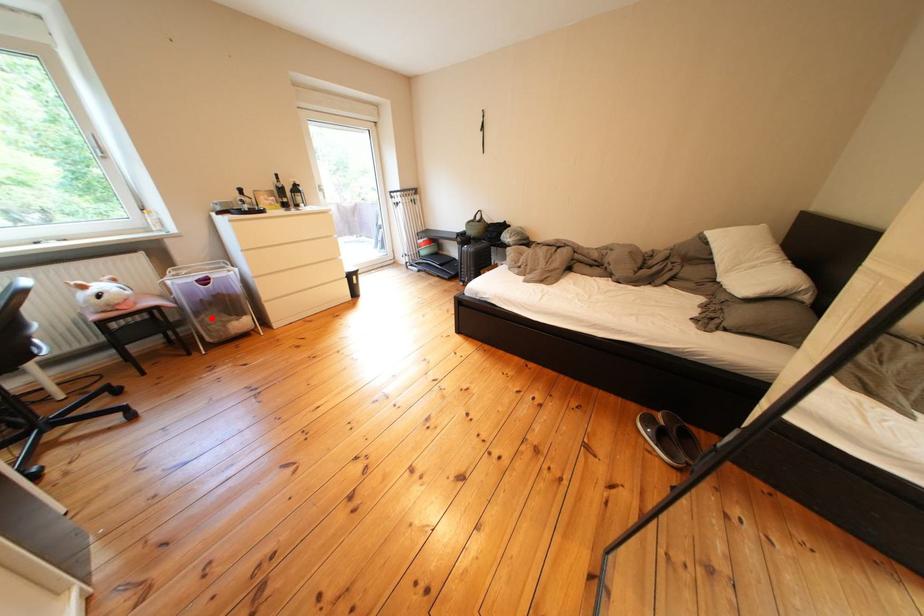
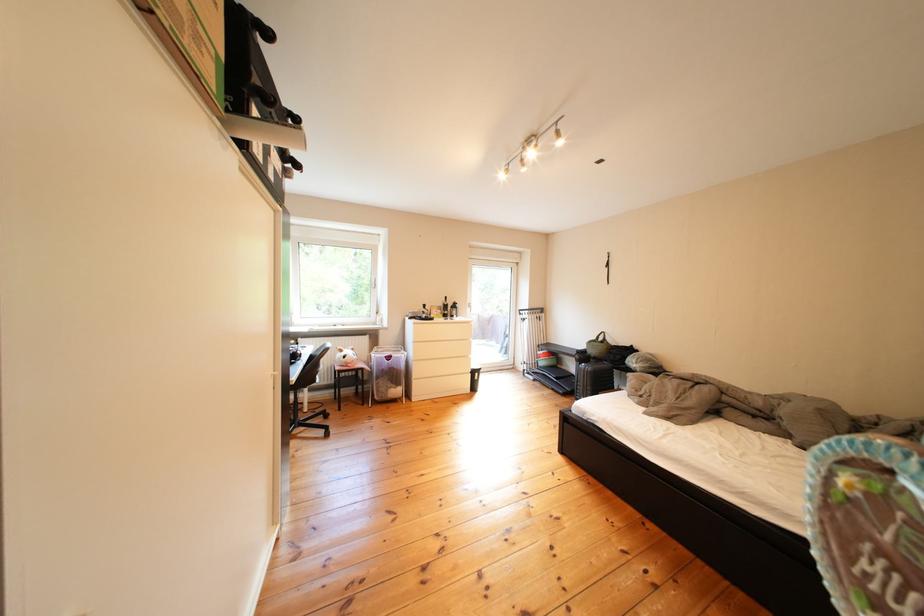
Question: I am providing you with two images of the same scene from different viewpoints. Given a red point in image1, look at the same physical point in image2. Is it:

Choices:
 (A) Closer to the viewpoint
 (B) Farther from the viewpoint

Answer: (B)